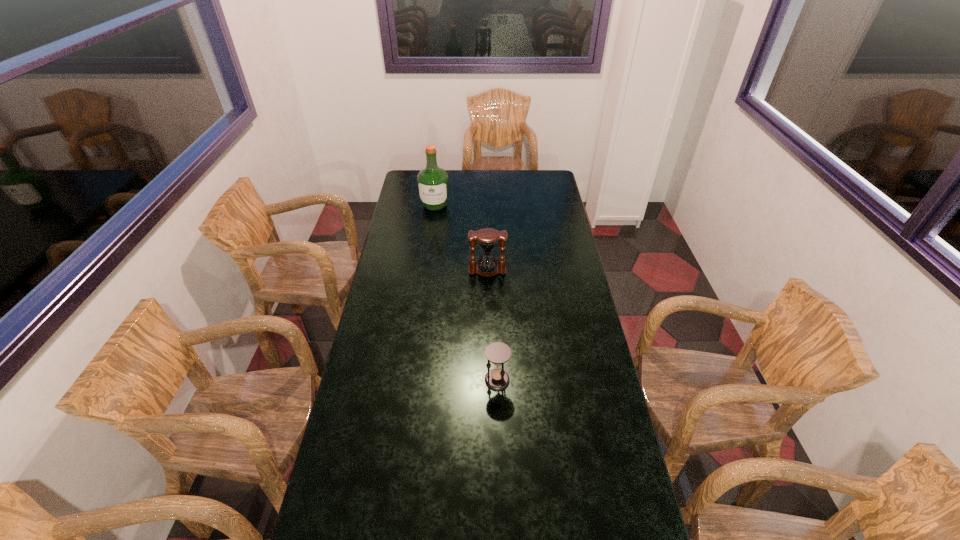
This screenshot has width=960, height=540. Identify the location of vacant space at the far edge of the desktop. (471, 188).

You are a GUI agent. You are given a task and a screenshot of the screen. Output one action in this format:
    pyautogui.click(x=<x>, y=<y>)
    Task: Click on the vacant space at the left edge of the desktop
    
    Given the screenshot: What is the action you would take?
    pyautogui.click(x=402, y=371)

At what (x,y) coordinates should I click in order to perform the action: click on blank space at the right edge. Please return your answer as a coordinate pair (x, y). Looking at the image, I should click on (636, 503).

In the image, there is a desktop. Identify the location of vacant space at the far right corner. The image size is (960, 540). (550, 177).

The image size is (960, 540). I want to click on free spot between the shortest object and the farthest object, so click(466, 293).

This screenshot has width=960, height=540. I want to click on vacant point located between the shortest object and the farther hourglass, so click(492, 325).

The width and height of the screenshot is (960, 540). Find the location of `vacant area between the nearer hourglass and the farther hourglass`. vacant area between the nearer hourglass and the farther hourglass is located at coordinates [x=492, y=325].

You are a GUI agent. You are given a task and a screenshot of the screen. Output one action in this format:
    pyautogui.click(x=<x>, y=<y>)
    Task: Click on the blank region between the tallest object and the taller hourglass
    The height and width of the screenshot is (540, 960).
    Given the screenshot: What is the action you would take?
    pyautogui.click(x=461, y=238)

This screenshot has height=540, width=960. What are the coordinates of `vacant space that's between the farthest object and the nearer hourglass` in the screenshot? It's located at (466, 293).

Find the location of a particular element. unoccupied position between the shorter hourglass and the second farthest object is located at coordinates (492, 325).